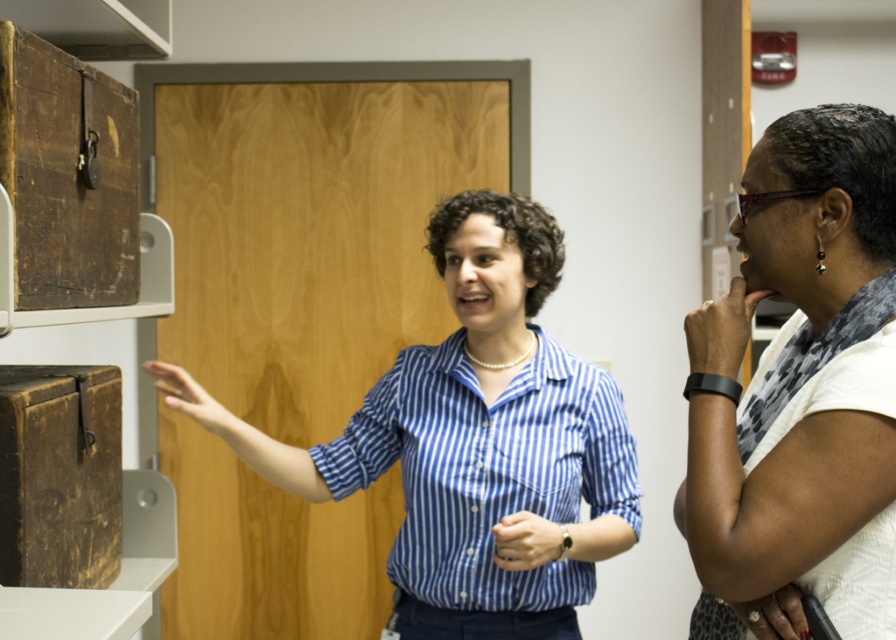
You are a delivery person who needs to place a package between the white textured shirt at right and the rustic wood drawer at upper left. The package is 35 inches long. Will it fit between them?

The distance between the white textured shirt at right and the rustic wood drawer at upper left is 35.39 inches. Since the package is 35 inches long, it will fit with a small amount of space to spare.

You are a security camera in the storage room. You need to determine if the distance between the blue striped shirt at center and the white textured shirt at right is within the 20 inches safety zone. Is it?

The blue striped shirt at center and white textured shirt at right are 18.30 inches apart from each other, which is within the 20 inches safety zone.

In the scene shown: You are a photographer trying to capture both the blue striped shirt at center and the white textured shirt at right in a single frame. Based on their positions, do you think you can fit both subjects into the camera view without moving either of them?

The blue striped shirt at center might be wider than white textured shirt at right, so there could be enough space to include both in the frame if the camera angle accommodates their widths.